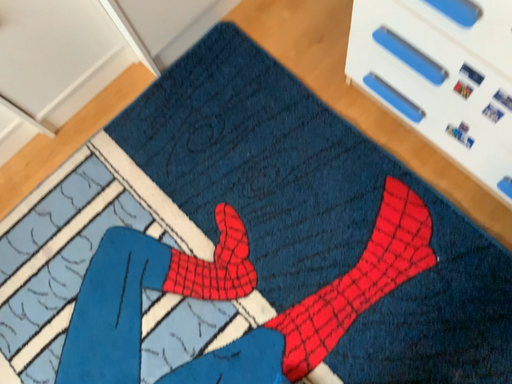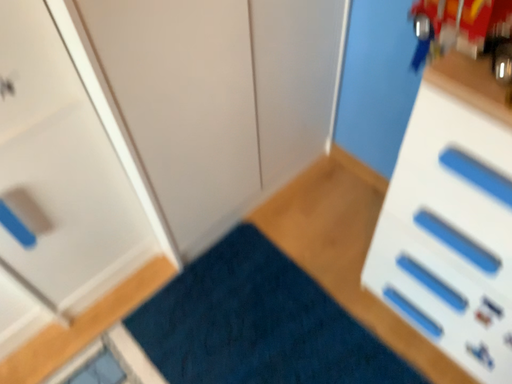
Question: How did the camera likely rotate when shooting the video?

Choices:
 (A) rotated downward
 (B) rotated upward

Answer: (B)